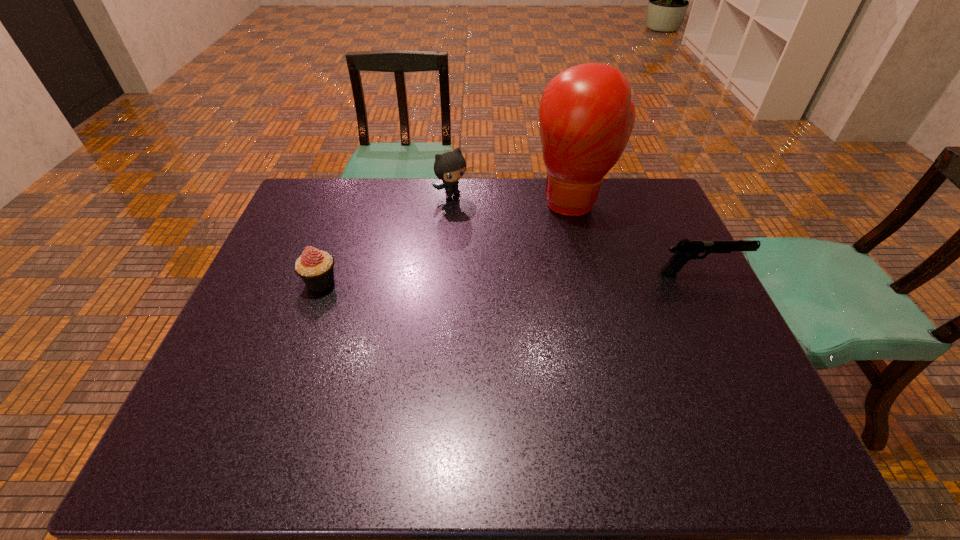
Identify the location of cupcake. (316, 268).

Locate an element on the screen. The height and width of the screenshot is (540, 960). gun is located at coordinates (685, 250).

Identify the location of kitten. (449, 167).

Find the location of a particular element. The image size is (960, 540). the second tallest object is located at coordinates (449, 167).

Locate an element on the screen. Image resolution: width=960 pixels, height=540 pixels. the third object from left to right is located at coordinates (586, 116).

Where is `the tallest object`? the tallest object is located at coordinates (586, 116).

In order to click on free space located 0.080m on the front of the leftmost object in this screenshot , I will do `click(307, 319)`.

Where is `free spot located 0.220m on the front-facing side of the third shortest object`? free spot located 0.220m on the front-facing side of the third shortest object is located at coordinates (502, 238).

Where is `vacant space located on the front-facing side of the third shortest object`? vacant space located on the front-facing side of the third shortest object is located at coordinates (473, 211).

This screenshot has height=540, width=960. What are the coordinates of `vacant space situated on the front-facing side of the third shortest object` in the screenshot? It's located at (475, 213).